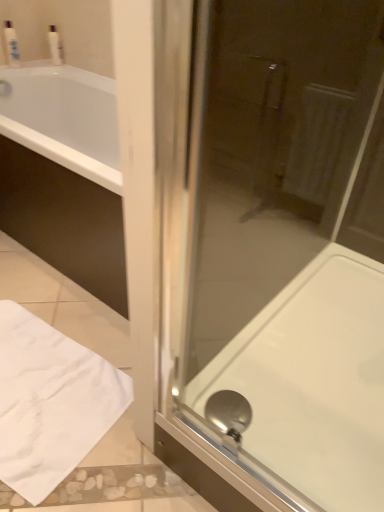
Question: Is the position of white plastic bottle at upper left, the first toiletry viewed from the left, more distant than that of white glossy bath at center?

Choices:
 (A) no
 (B) yes

Answer: (B)

Question: Is white plastic bottle at upper left, which appears as the second toiletry when viewed from the right, far from white glossy bath at center?

Choices:
 (A) yes
 (B) no

Answer: (A)

Question: Is white plastic bottle at upper left, which appears as the second toiletry when viewed from the right, to the right of white glossy bath at center from the viewer's perspective?

Choices:
 (A) no
 (B) yes

Answer: (A)

Question: Is white plastic bottle at upper left, which appears as the second toiletry when viewed from the right, facing towards white glossy bath at center?

Choices:
 (A) yes
 (B) no

Answer: (A)

Question: From a real-world perspective, is white plastic bottle at upper left, the first toiletry viewed from the left, positioned over white glossy bath at center based on gravity?

Choices:
 (A) yes
 (B) no

Answer: (A)

Question: Is white plastic bottle at upper left, the first toiletry viewed from the left, closer to camera compared to white glossy bath at center?

Choices:
 (A) yes
 (B) no

Answer: (B)

Question: Does white glossy bath at center appear on the left side of white fabric towel at lower left?

Choices:
 (A) no
 (B) yes

Answer: (A)

Question: Is there a large distance between white glossy bath at center and white fabric towel at lower left?

Choices:
 (A) yes
 (B) no

Answer: (B)

Question: Is white glossy bath at center taller than white fabric towel at lower left?

Choices:
 (A) no
 (B) yes

Answer: (B)

Question: Are white glossy bath at center and white fabric towel at lower left beside each other?

Choices:
 (A) yes
 (B) no

Answer: (B)

Question: Can you confirm if white glossy bath at center is positioned to the right of white fabric towel at lower left?

Choices:
 (A) yes
 (B) no

Answer: (A)

Question: Does white glossy bath at center have a larger size compared to white fabric towel at lower left?

Choices:
 (A) no
 (B) yes

Answer: (B)

Question: Can you confirm if white glossy bath at center is thinner than transparent glass shower door at center?

Choices:
 (A) no
 (B) yes

Answer: (A)